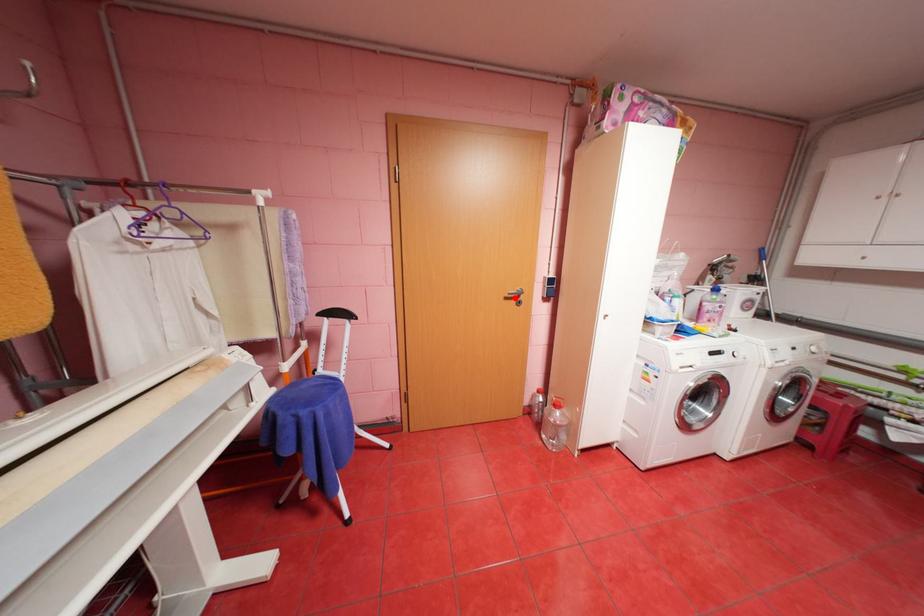
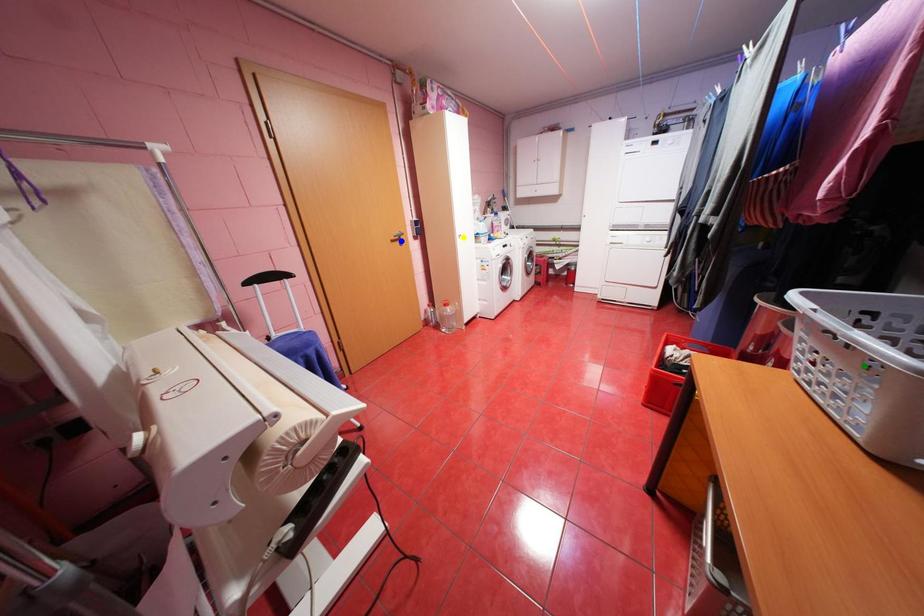
Question: I am providing you with two images of the same scene from different viewpoints. A red point is marked on the first image. You are given multiple points on the second image. Which mark in image 2 goes with the point in image 1?

Choices:
 (A) green point
 (B) yellow point
 (C) blue point

Answer: (C)